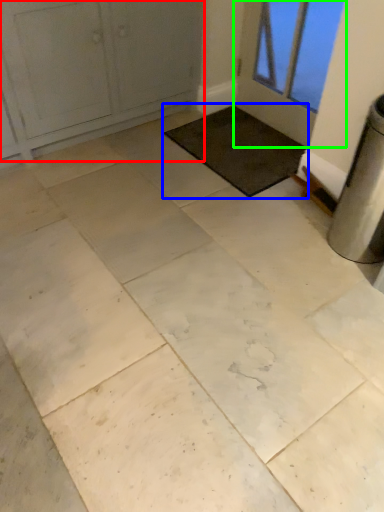
Question: Which object is positioned farthest from door (highlighted by a red box)? Select from mat (highlighted by a blue box) and door (highlighted by a green box).

Choices:
 (A) mat
 (B) door

Answer: (B)